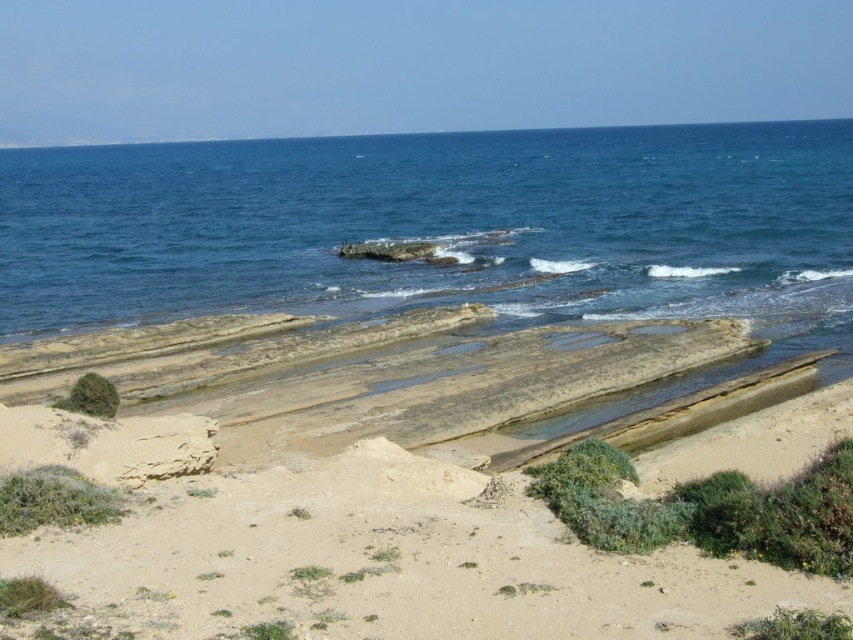
Does blue water at center lie behind brown sandy beach at lower center?

Yes, blue water at center is behind brown sandy beach at lower center.

Consider the image. Is blue water at center thinner than brown sandy beach at lower center?

In fact, blue water at center might be wider than brown sandy beach at lower center.

What do you see at coordinates (440, 228) in the screenshot? The height and width of the screenshot is (640, 853). I see `blue water at center` at bounding box center [440, 228].

This screenshot has width=853, height=640. Find the location of `blue water at center`. blue water at center is located at coordinates (440, 228).